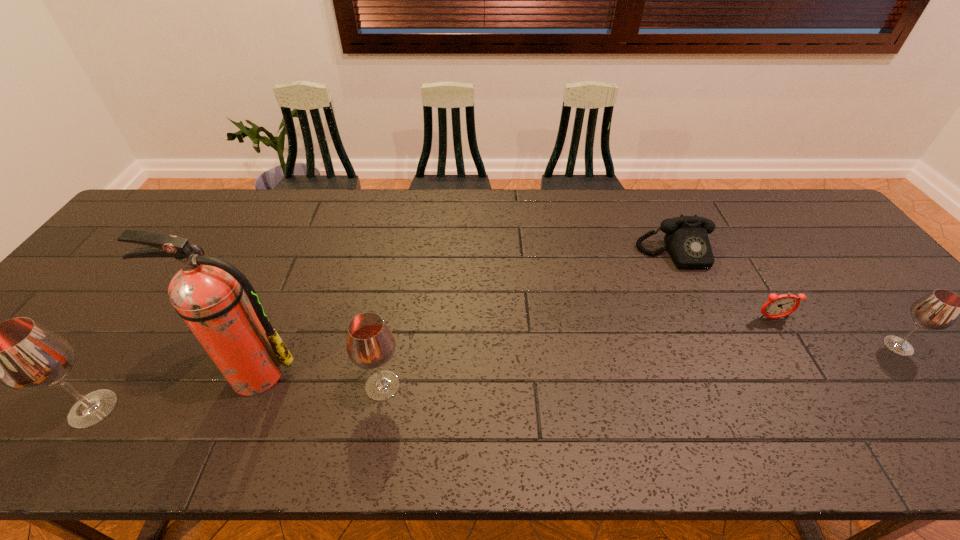
Identify the location of the fifth shortest object. The image size is (960, 540). (21, 354).

Locate an element on the screen. The image size is (960, 540). the tallest wineglass is located at coordinates (21, 354).

Find the location of a particular element. This screenshot has width=960, height=540. the second shortest wineglass is located at coordinates (370, 344).

Where is `the fourth object from right to left`? the fourth object from right to left is located at coordinates (370, 344).

You are a GUI agent. You are given a task and a screenshot of the screen. Output one action in this format:
    pyautogui.click(x=<x>, y=<y>)
    Task: Click on the rightmost object
    This screenshot has width=960, height=540.
    Given the screenshot: What is the action you would take?
    pyautogui.click(x=938, y=310)

Identify the location of the shortest wineglass. (938, 310).

Identify the location of telephone. The width and height of the screenshot is (960, 540). click(686, 239).

Locate an element on the screen. The image size is (960, 540). the fourth object from left to right is located at coordinates (686, 239).

Where is `the second object from left to right`? the second object from left to right is located at coordinates (207, 292).

Identify the location of the tallest object. (207, 292).